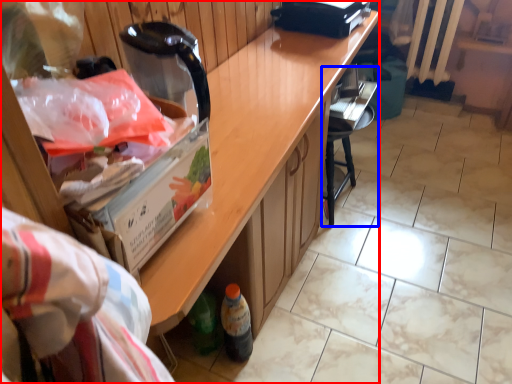
Question: Which point is further to the camera, cabinetry (highlighted by a red box) or chair (highlighted by a blue box)?

Choices:
 (A) cabinetry
 (B) chair

Answer: (B)